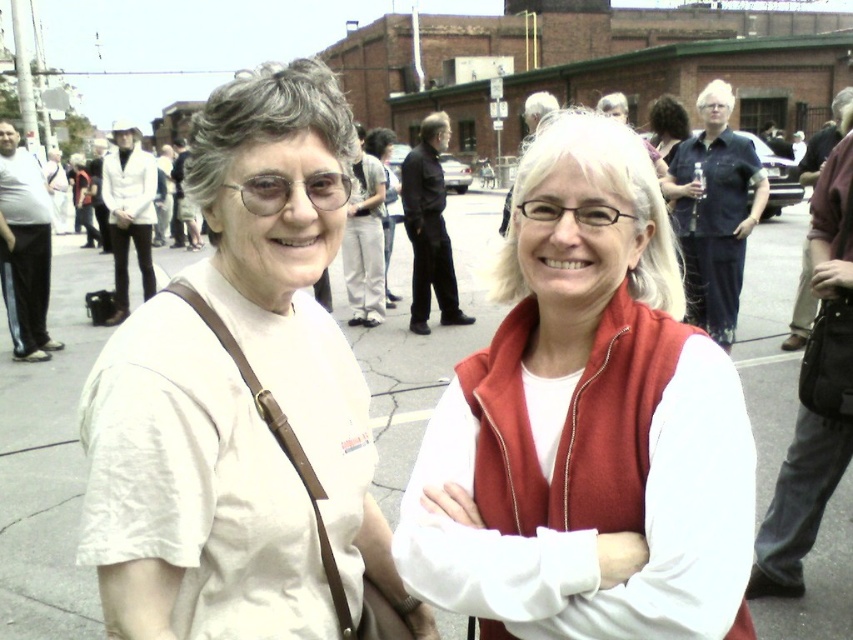
Which is more to the left, matte red vest at center or gray asphalt pavement at center?

matte red vest at center

The image size is (853, 640). What are the coordinates of `matte red vest at center` in the screenshot? It's located at (585, 424).

Does matte red vest at center appear on the right side of denim shirt at upper right?

In fact, matte red vest at center is to the left of denim shirt at upper right.

Can you confirm if matte red vest at center is positioned above denim shirt at upper right?

No.

Image resolution: width=853 pixels, height=640 pixels. Describe the element at coordinates (585, 424) in the screenshot. I see `matte red vest at center` at that location.

You are a GUI agent. You are given a task and a screenshot of the screen. Output one action in this format:
    pyautogui.click(x=<x>, y=<y>)
    Task: Click on the matte red vest at center
    
    Given the screenshot: What is the action you would take?
    pyautogui.click(x=585, y=424)

Can you confirm if white matte shirt at left is positioned to the left of gray asphalt pavement at center?

Correct, you'll find white matte shirt at left to the left of gray asphalt pavement at center.

Can you confirm if white matte shirt at left is shorter than gray asphalt pavement at center?

Correct, white matte shirt at left is not as tall as gray asphalt pavement at center.

Describe the element at coordinates (241, 397) in the screenshot. I see `white matte shirt at left` at that location.

I want to click on white matte shirt at left, so click(x=241, y=397).